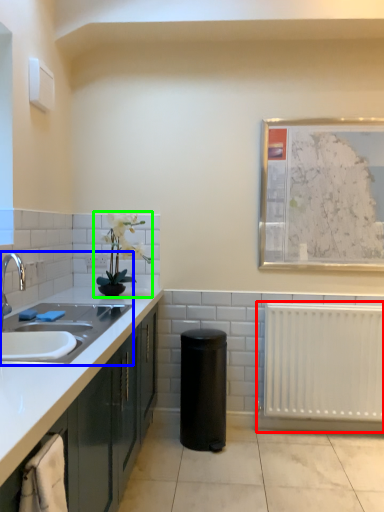
Question: Which is nearer to the radiator (highlighted by a red box)? sink (highlighted by a blue box) or houseplant (highlighted by a green box).

Choices:
 (A) sink
 (B) houseplant

Answer: (B)